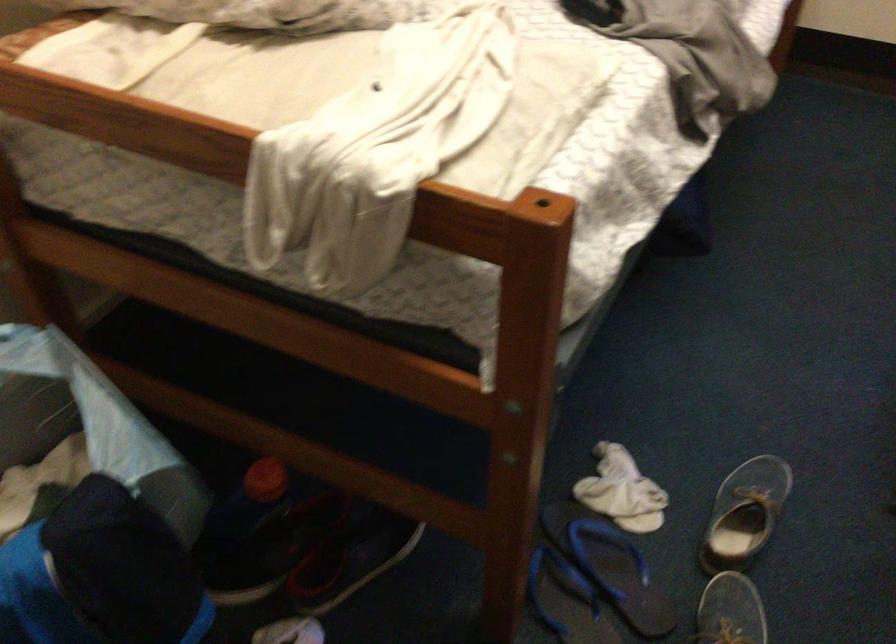
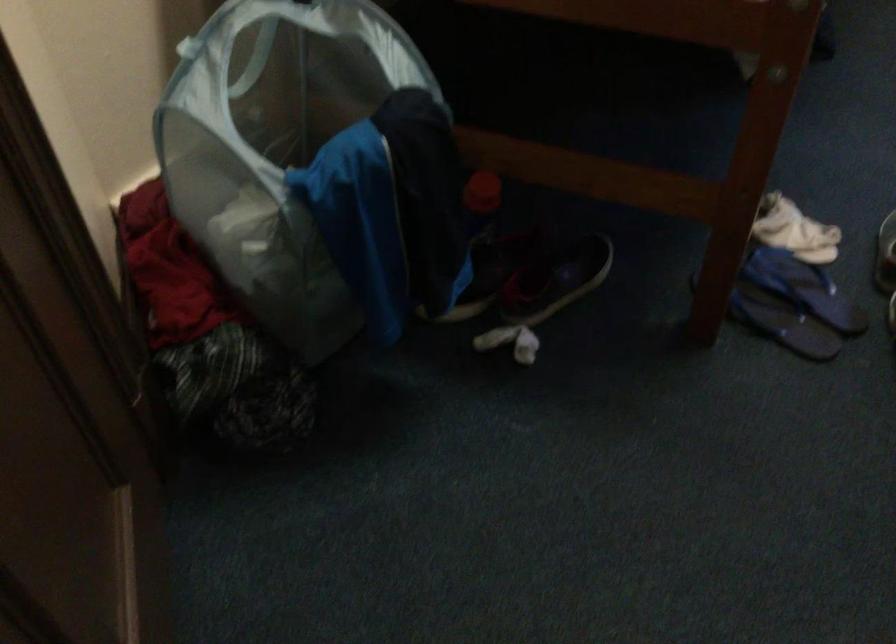
Locate, in the second image, the point that corresponds to point 349,565 in the first image.

(556, 279)